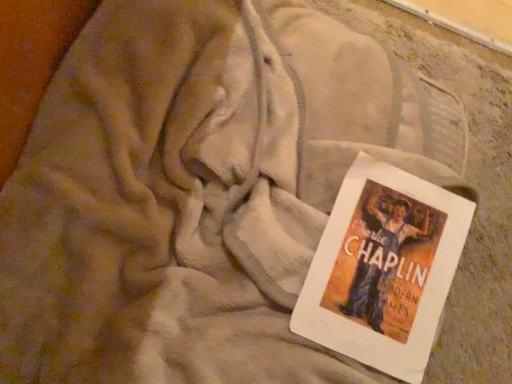
This screenshot has height=384, width=512. What do you see at coordinates (383, 269) in the screenshot? I see `white paper at center` at bounding box center [383, 269].

In order to face white paper at center, should I rotate leftwards or rightwards?

To align with it, rotate right about 16.063°.

You are a GUI agent. You are given a task and a screenshot of the screen. Output one action in this format:
    pyautogui.click(x=<x>, y=<y>)
    Task: Click on the white paper at center
    
    Given the screenshot: What is the action you would take?
    pyautogui.click(x=383, y=269)

Identify the location of white paper at center. The height and width of the screenshot is (384, 512). (383, 269).